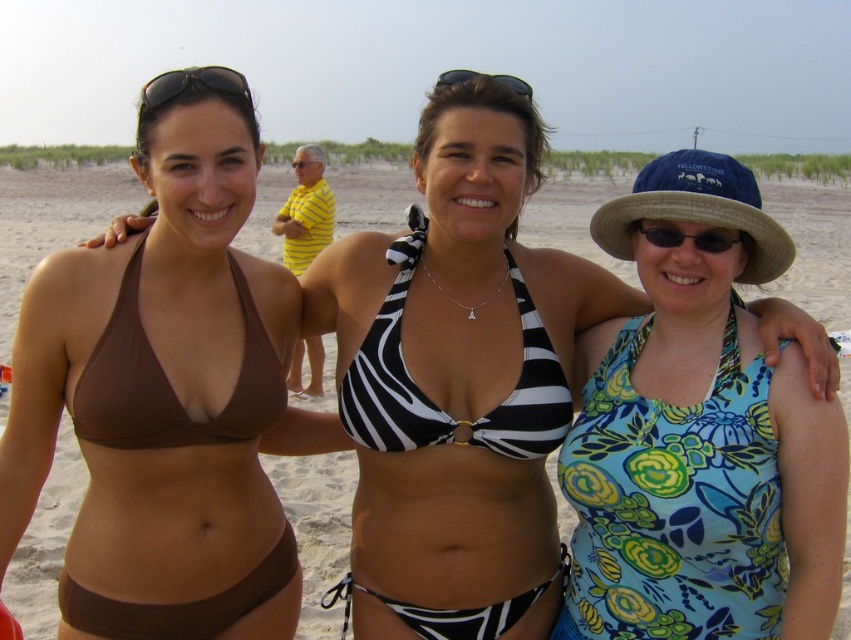
Can you confirm if floral print fabric bikini top at right is shorter than yellow striped polo shirt at center?

Indeed, floral print fabric bikini top at right has a lesser height compared to yellow striped polo shirt at center.

Between floral print fabric bikini top at right and yellow striped polo shirt at center, which one is positioned lower?

floral print fabric bikini top at right

The image size is (851, 640). Identify the location of floral print fabric bikini top at right. (672, 506).

In order to click on floral print fabric bikini top at right in this screenshot , I will do `click(672, 506)`.

Does yellow striped polo shirt at center have a larger size compared to black plastic sunglasses at center?

Actually, yellow striped polo shirt at center might be smaller than black plastic sunglasses at center.

Is point (328, 198) less distant than point (454, 74)?

No, (328, 198) is further to viewer.

Between point (306, 172) and point (490, 76), which one is positioned in front?

Point (490, 76) is more forward.

Where is `yellow striped polo shirt at center`? The width and height of the screenshot is (851, 640). yellow striped polo shirt at center is located at coordinates (306, 211).

Describe the element at coordinates (672, 506) in the screenshot. I see `floral print fabric bikini top at right` at that location.

At what (x,y) coordinates should I click in order to perform the action: click on floral print fabric bikini top at right. Please return your answer as a coordinate pair (x, y). This screenshot has height=640, width=851. Looking at the image, I should click on (672, 506).